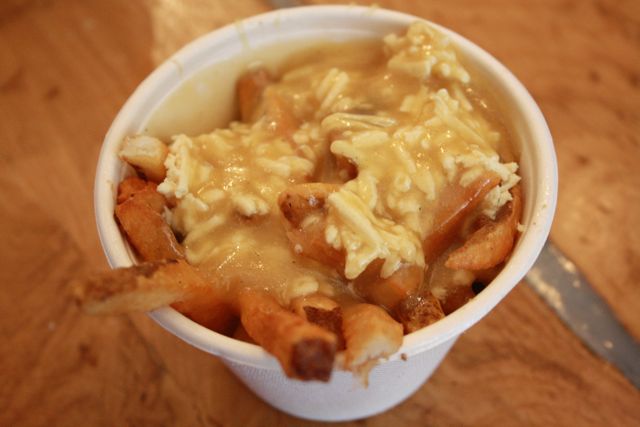
The image size is (640, 427). Identify the location of plastic cup. (419, 352).